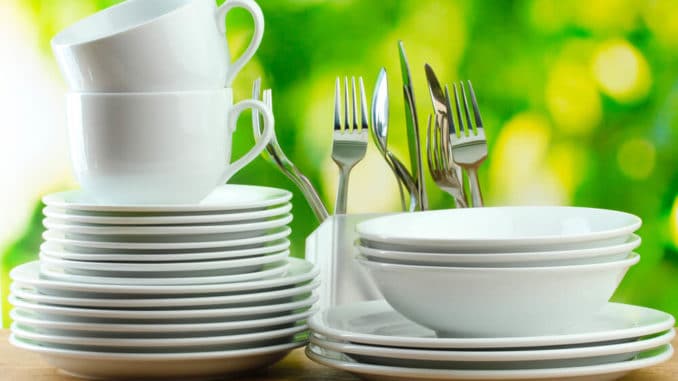
Locate an element on the screen. forks is located at coordinates (471, 142), (435, 155), (351, 140), (287, 164), (266, 156).